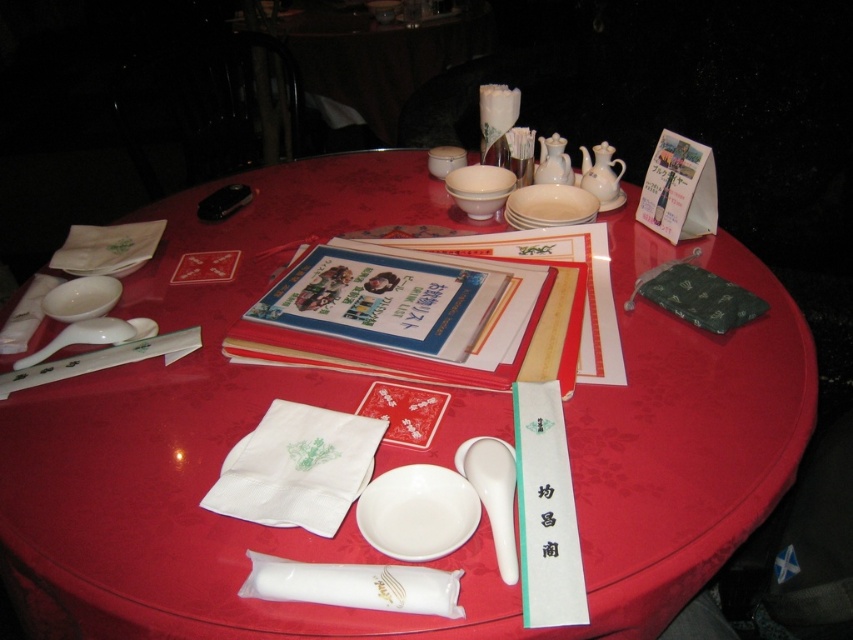
From the picture: Which of these two, translucent plastic toothpicks at center or black plastic remote at center, stands shorter?

With less height is black plastic remote at center.

Consider the image. Can you confirm if translucent plastic toothpicks at center is positioned above black plastic remote at center?

Yes.

The width and height of the screenshot is (853, 640). What do you see at coordinates (520, 154) in the screenshot?
I see `translucent plastic toothpicks at center` at bounding box center [520, 154].

This screenshot has width=853, height=640. What are the coordinates of `translucent plastic toothpicks at center` in the screenshot? It's located at (520, 154).

Who is positioned more to the right, white glossy plate at center or white ceramic plates at center?

From the viewer's perspective, white ceramic plates at center appears more on the right side.

Does white glossy plate at center have a larger size compared to white ceramic plates at center?

Actually, white glossy plate at center might be smaller than white ceramic plates at center.

What do you see at coordinates (416, 512) in the screenshot?
I see `white glossy plate at center` at bounding box center [416, 512].

Find the location of `white glossy plate at center`. white glossy plate at center is located at coordinates (416, 512).

Between white porcelain bowls at center and white ceramic bowl at upper center, which one is positioned lower?

white porcelain bowls at center

Between point (454, 173) and point (451, 147), which one is positioned behind?

The point (451, 147) is more distant.

Identify the location of white porcelain bowls at center. (479, 188).